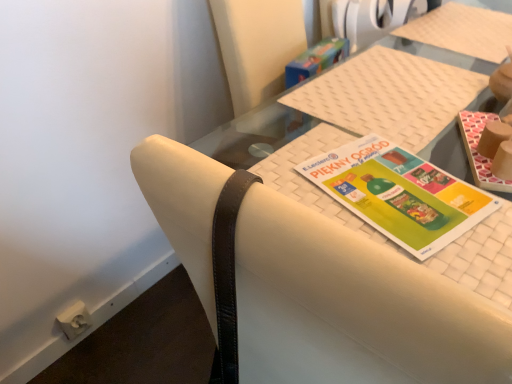
Identify the location of free space above multicolored paper at center, positioned as the 1th book in left-to-right order (from a real-world perspective). This screenshot has width=512, height=384. (388, 185).